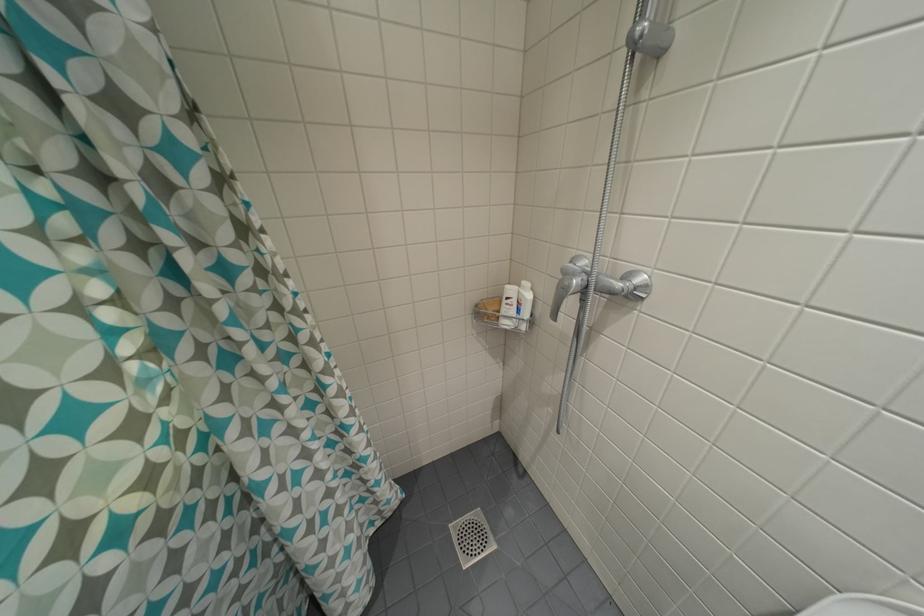
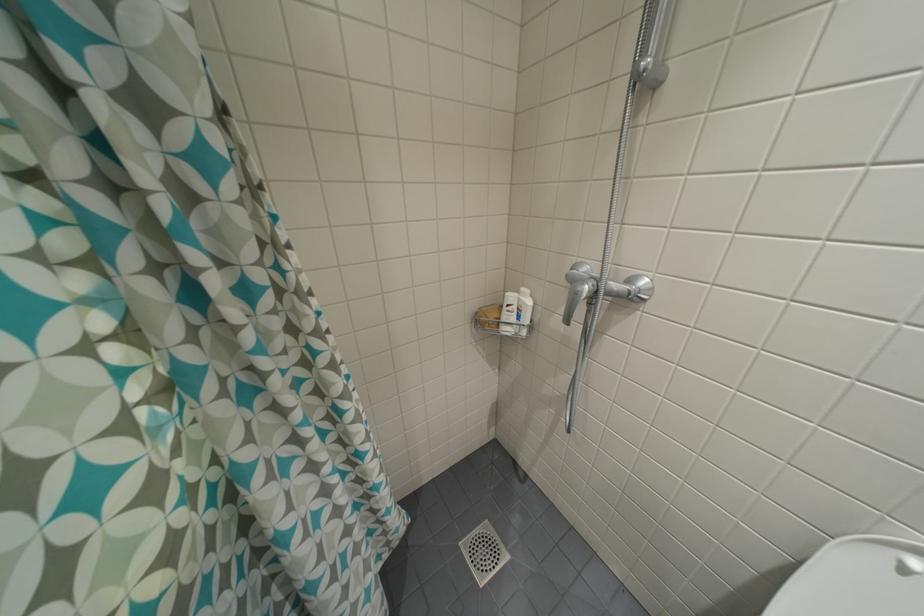
Question: The camera is either moving clockwise (left) or counter-clockwise (right) around the object. The first image is from the beginning of the video and the second image is from the end. Is the camera moving left or right when shooting the video?

Choices:
 (A) Left
 (B) Right

Answer: (A)